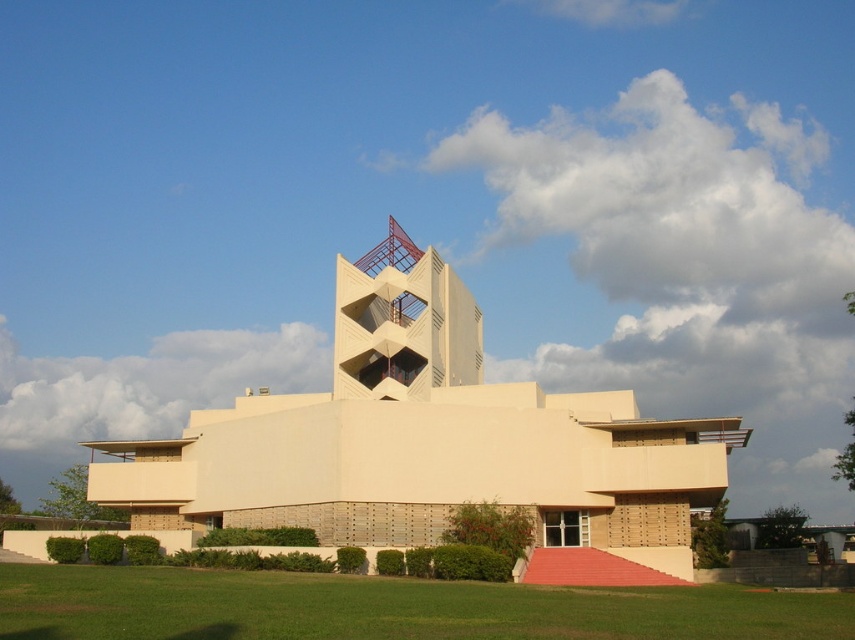
Question: Can you confirm if beige concrete building at center is wider than green grass at lower center?

Choices:
 (A) yes
 (B) no

Answer: (A)

Question: In this image, where is beige concrete building at center located relative to green grass at lower center?

Choices:
 (A) above
 (B) below

Answer: (A)

Question: Among these points, which one is nearest to the camera?

Choices:
 (A) (460, 364)
 (B) (553, 616)

Answer: (B)

Question: Does beige concrete building at center appear over green grass at lower center?

Choices:
 (A) no
 (B) yes

Answer: (B)